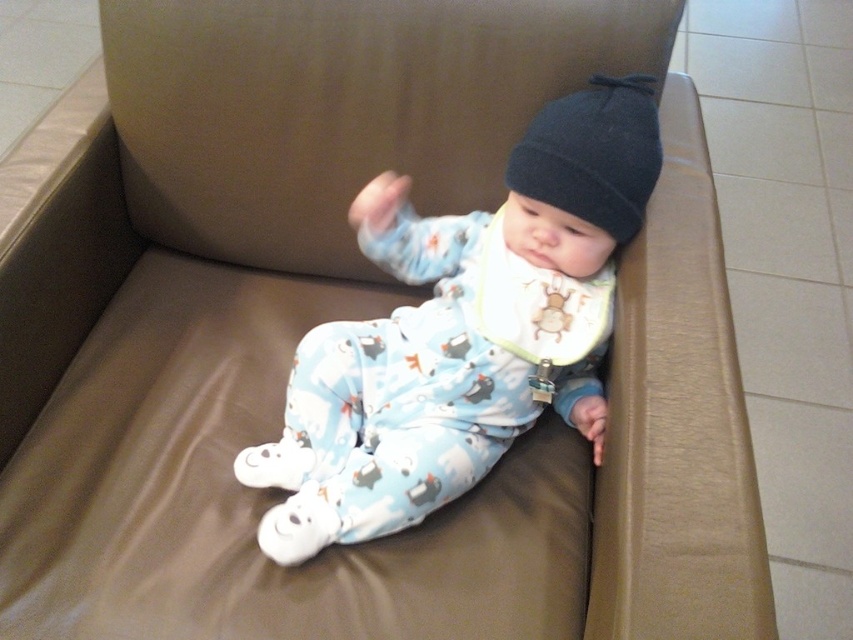
Which is above, blue cotton onesie at center or black knit beanie at upper center?

black knit beanie at upper center

Between point (451, 397) and point (642, 186), which one is positioned behind?

Point (451, 397)

I want to click on blue cotton onesie at center, so click(x=463, y=330).